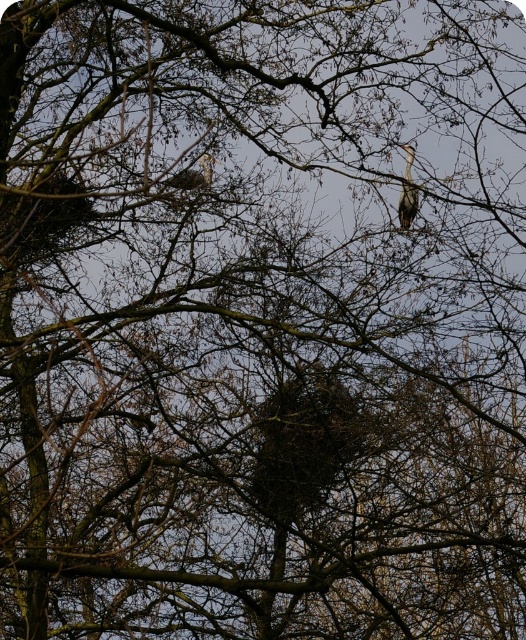
Question: Which object appears farthest from the camera in this image?

Choices:
 (A) white feathered bird at upper center
 (B) gray feathered bird at upper right

Answer: (A)

Question: Considering the relative positions of gray feathered bird at upper right and white feathered bird at upper center in the image provided, where is gray feathered bird at upper right located with respect to white feathered bird at upper center?

Choices:
 (A) below
 (B) above

Answer: (A)

Question: Does gray feathered bird at upper right appear on the left side of white feathered bird at upper center?

Choices:
 (A) yes
 (B) no

Answer: (B)

Question: Is gray feathered bird at upper right wider than white feathered bird at upper center?

Choices:
 (A) yes
 (B) no

Answer: (B)

Question: Which point is closer to the camera?

Choices:
 (A) (196, 182)
 (B) (409, 189)

Answer: (B)

Question: Which object is closer to the camera taking this photo?

Choices:
 (A) gray feathered bird at upper right
 (B) white feathered bird at upper center

Answer: (A)